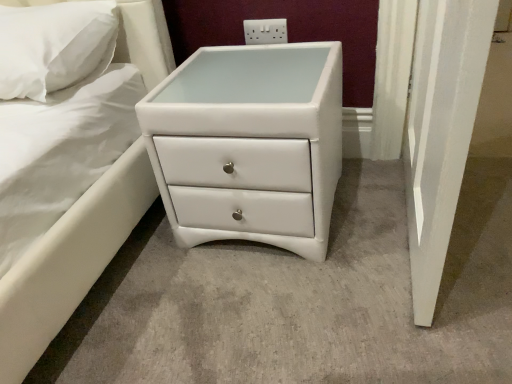
Question: Would you consider white plastic electric outlet at upper center to be distant from white leather chest of drawers at center?

Choices:
 (A) no
 (B) yes

Answer: (A)

Question: Can you confirm if white plastic electric outlet at upper center is positioned to the right of white leather chest of drawers at center?

Choices:
 (A) yes
 (B) no

Answer: (A)

Question: From a real-world perspective, is white plastic electric outlet at upper center on top of white leather chest of drawers at center?

Choices:
 (A) no
 (B) yes

Answer: (B)

Question: Is white leather chest of drawers at center located within white plastic electric outlet at upper center?

Choices:
 (A) yes
 (B) no

Answer: (B)

Question: Could you tell me if white plastic electric outlet at upper center is facing white leather chest of drawers at center?

Choices:
 (A) yes
 (B) no

Answer: (A)

Question: From the image's perspective, is white plastic electric outlet at upper center beneath white leather chest of drawers at center?

Choices:
 (A) no
 (B) yes

Answer: (A)

Question: From the image's perspective, does white soft pillow at upper left appear higher than white leather chest of drawers at center?

Choices:
 (A) yes
 (B) no

Answer: (A)

Question: Can you confirm if white soft pillow at upper left is taller than white leather chest of drawers at center?

Choices:
 (A) no
 (B) yes

Answer: (A)

Question: Can you confirm if white soft pillow at upper left is wider than white leather chest of drawers at center?

Choices:
 (A) no
 (B) yes

Answer: (A)

Question: Is white soft pillow at upper left located outside white leather chest of drawers at center?

Choices:
 (A) yes
 (B) no

Answer: (A)

Question: From a real-world perspective, is white soft pillow at upper left over white leather chest of drawers at center?

Choices:
 (A) yes
 (B) no

Answer: (A)

Question: Is white leather chest of drawers at center surrounded by white soft pillow at upper left?

Choices:
 (A) yes
 (B) no

Answer: (B)

Question: Is white soft pillow at upper left touching white plastic electric outlet at upper center?

Choices:
 (A) yes
 (B) no

Answer: (B)